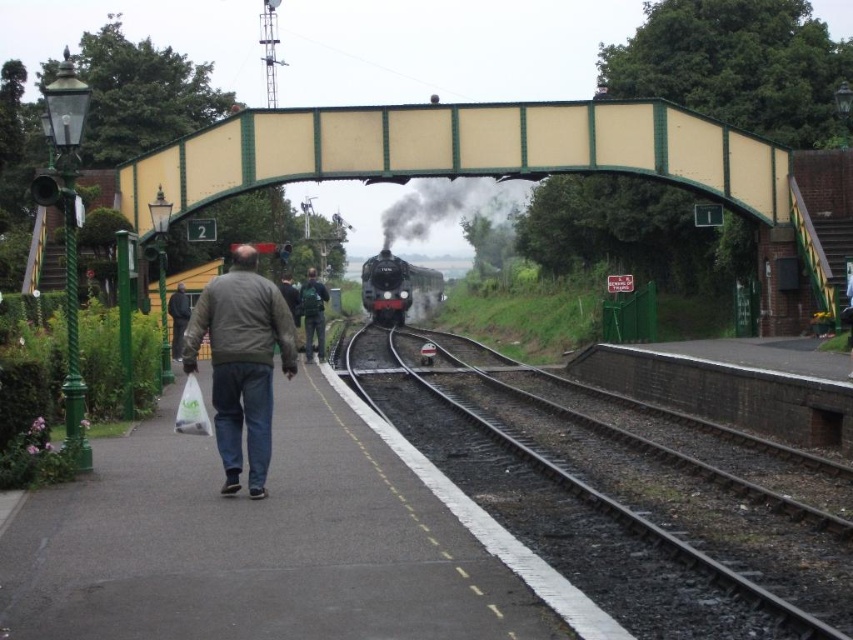
Is dark gray jacket at center bigger than black metallic steam at center?

No, dark gray jacket at center is not bigger than black metallic steam at center.

Which of these two, dark gray jacket at center or black metallic steam at center, stands shorter?

dark gray jacket at center

What do you see at coordinates (241, 362) in the screenshot? The height and width of the screenshot is (640, 853). I see `dark gray jacket at center` at bounding box center [241, 362].

Locate an element on the screen. The height and width of the screenshot is (640, 853). dark gray jacket at center is located at coordinates (241, 362).

Is point (355, 337) less distant than point (424, 284)?

That is True.

What do you see at coordinates (625, 500) in the screenshot? This screenshot has width=853, height=640. I see `black metal train track at lower center` at bounding box center [625, 500].

In order to click on black metal train track at lower center in this screenshot , I will do `click(625, 500)`.

The width and height of the screenshot is (853, 640). I want to click on black metal train track at lower center, so click(x=625, y=500).

Between yellow painted metal bridge at center and dark gray jacket at center, which one appears on the left side from the viewer's perspective?

From the viewer's perspective, dark gray jacket at center appears more on the left side.

Does yellow painted metal bridge at center have a lesser width compared to dark gray jacket at center?

No.

The width and height of the screenshot is (853, 640). Identify the location of yellow painted metal bridge at center. (459, 150).

Locate an element on the screen. Image resolution: width=853 pixels, height=640 pixels. yellow painted metal bridge at center is located at coordinates coord(459,150).